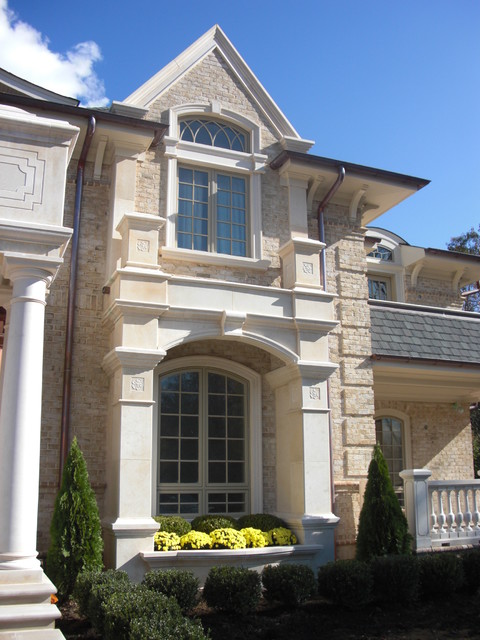
Where is `pillar`? This screenshot has height=640, width=480. pillar is located at coordinates (33, 563).